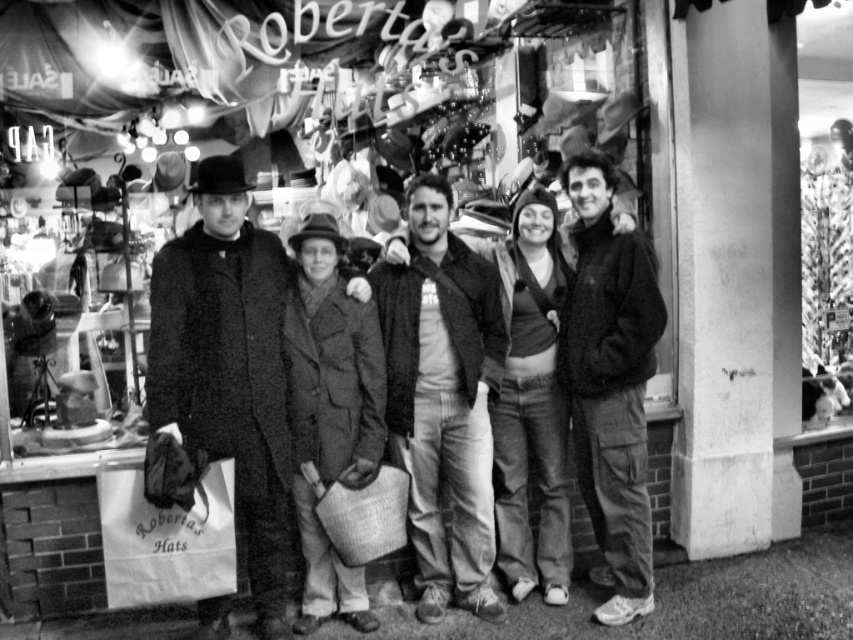
Between matte black jacket at center and dark gray fleece jacket at right, which one is positioned lower?

Positioned lower is matte black jacket at center.

Describe the element at coordinates (442, 397) in the screenshot. I see `matte black jacket at center` at that location.

Describe the element at coordinates (442, 397) in the screenshot. I see `matte black jacket at center` at that location.

Find the location of a particular element. The image size is (853, 640). matte black jacket at center is located at coordinates [442, 397].

Based on the photo, is smooth black coat at center shorter than matte black jacket at center?

Incorrect, smooth black coat at center's height does not fall short of matte black jacket at center's.

The height and width of the screenshot is (640, 853). Describe the element at coordinates (228, 369) in the screenshot. I see `smooth black coat at center` at that location.

Identify the location of smooth black coat at center. The image size is (853, 640). (228, 369).

In order to click on smooth black coat at center in this screenshot , I will do `click(228, 369)`.

Is smooth black coat at center positioned at the back of dark gray fleece jacket at right?

No, smooth black coat at center is closer to the viewer.

Consider the image. Can you confirm if smooth black coat at center is taller than dark gray fleece jacket at right?

No.

Is point (236, 397) positioned after point (567, 321)?

No, it is not.

The width and height of the screenshot is (853, 640). Identify the location of smooth black coat at center. (228, 369).